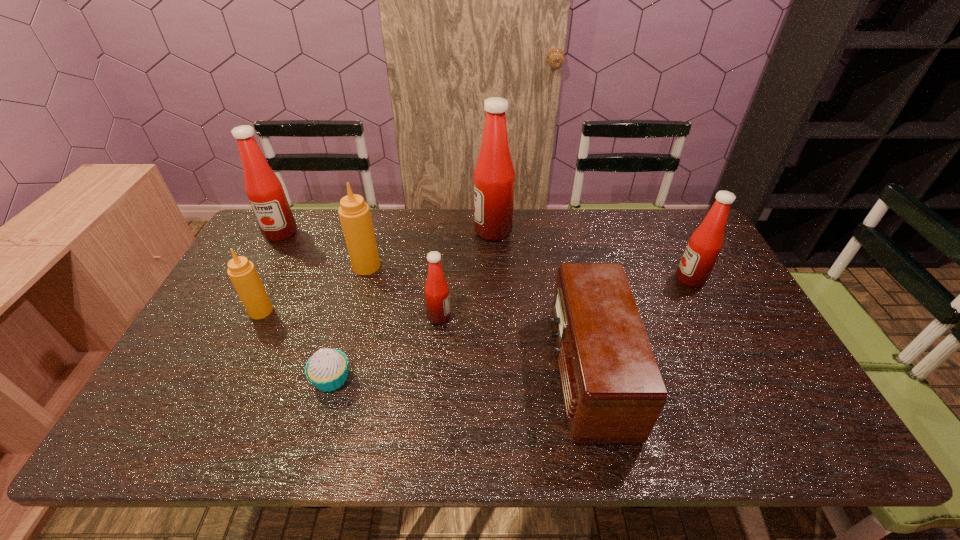
This screenshot has height=540, width=960. What are the coordinates of `vacant space located 0.260m on the front-facing side of the third biggest red condiment` in the screenshot? It's located at (591, 279).

The image size is (960, 540). I want to click on free location located 0.140m on the front-facing side of the third biggest red condiment, so click(x=631, y=279).

This screenshot has height=540, width=960. Identify the location of vacant region located 0.120m on the front-facing side of the third biggest red condiment. (637, 279).

The width and height of the screenshot is (960, 540). In order to click on blank space located on the front of the smaller tan condiment in this screenshot , I will do `click(222, 392)`.

The image size is (960, 540). I want to click on vacant position located on the front-facing side of the smallest red condiment, so click(468, 317).

Where is `free space located on the front-facing side of the radio receiver`? The height and width of the screenshot is (540, 960). free space located on the front-facing side of the radio receiver is located at coordinates (440, 372).

In order to click on vacant area situated on the front-facing side of the radio receiver in this screenshot , I will do `click(444, 372)`.

This screenshot has width=960, height=540. I want to click on free space located 0.140m on the front-facing side of the radio receiver, so click(496, 372).

You are a GUI agent. You are given a task and a screenshot of the screen. Output one action in this format:
    pyautogui.click(x=<x>, y=<y>)
    Task: Click on the vacant space located on the back of the white cupcake
    This screenshot has height=540, width=960.
    Given the screenshot: What is the action you would take?
    pyautogui.click(x=346, y=328)

I want to click on object located in the near edge section of the desktop, so click(613, 390).